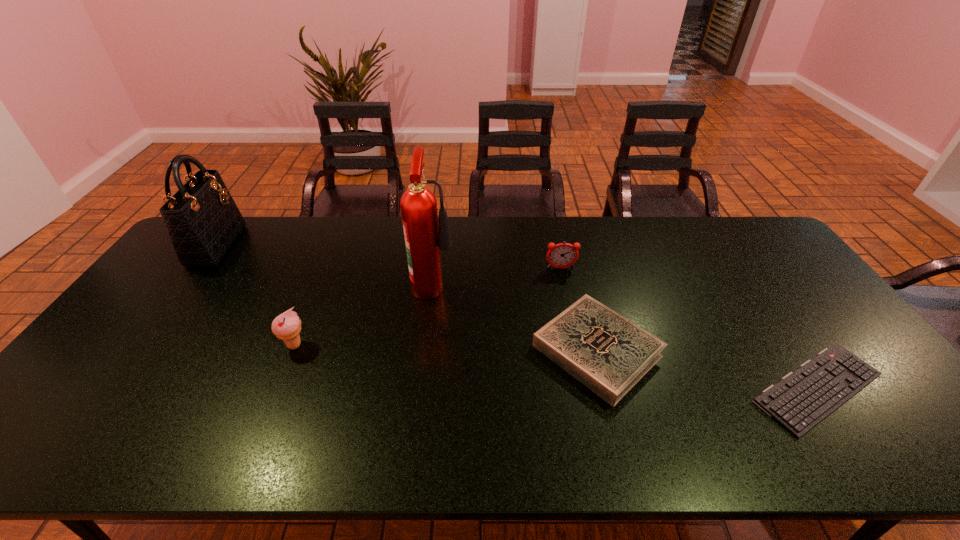
This screenshot has width=960, height=540. I want to click on vacant space located at the nozzle of the tallest object, so [x=481, y=283].

Find the location of a particular element. The width and height of the screenshot is (960, 540). vacant space located 0.230m at the front of the handbag with visible charms is located at coordinates (300, 245).

Find the location of a particular element. free space located on the right of the icecream is located at coordinates (423, 345).

Find the location of a particular element. vacant space located 0.340m on the front-facing side of the alarm clock is located at coordinates (579, 354).

Find the location of a particular element. This screenshot has height=540, width=960. free space located 0.120m on the front of the hardback book is located at coordinates (624, 456).

At what (x,y) coordinates should I click in order to perform the action: click on vacant space located on the back of the computer keyboard. Please return your answer as a coordinate pair (x, y). The height and width of the screenshot is (540, 960). Looking at the image, I should click on (778, 329).

The height and width of the screenshot is (540, 960). In order to click on object present at the far edge in this screenshot , I will do `click(203, 222)`.

Find the location of a particular element. The height and width of the screenshot is (540, 960). object present at the near edge is located at coordinates (803, 398).

This screenshot has height=540, width=960. Identify the location of object located in the left edge section of the desktop. (203, 222).

At what (x,y) coordinates should I click in order to perform the action: click on object located at the right edge. Please return your answer as a coordinate pair (x, y). This screenshot has height=540, width=960. Looking at the image, I should click on (803, 398).